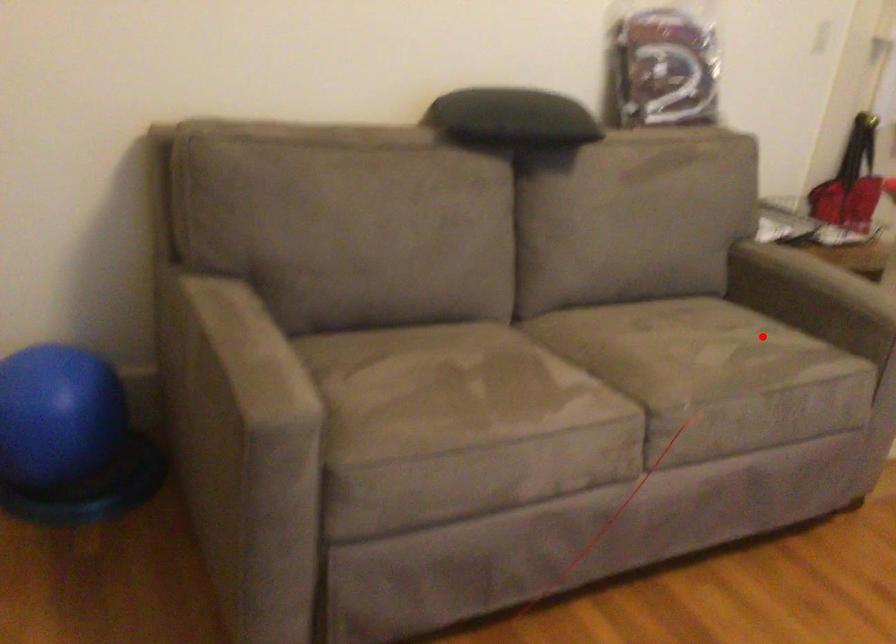
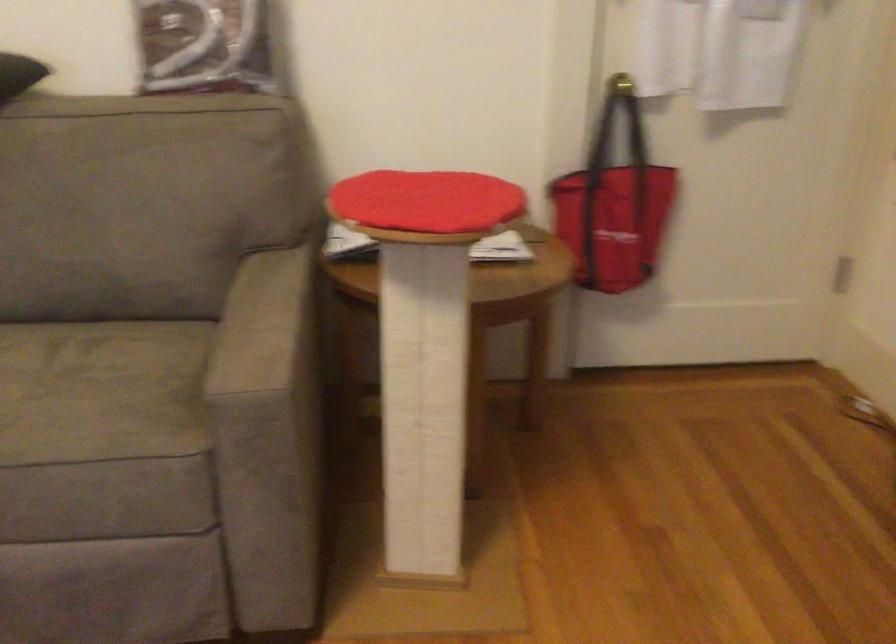
The point at the highlighted location is marked in the first image. Where is the corresponding point in the second image?

(101, 391)